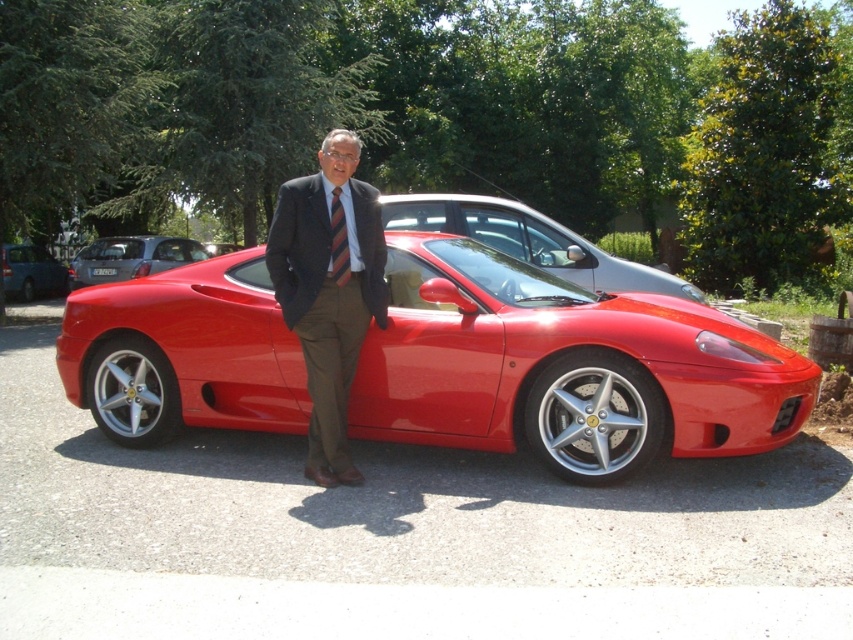
Who is more distant from viewer, (647, 408) or (343, 243)?

Point (647, 408)

Can you confirm if shiny red sports car at center is shorter than striped fabric tie at center?

No, shiny red sports car at center is not shorter than striped fabric tie at center.

At what (x,y) coordinates should I click in order to perform the action: click on shiny red sports car at center. Please return your answer as a coordinate pair (x, y). This screenshot has width=853, height=640. Looking at the image, I should click on (564, 368).

Can you confirm if glossy metallic hatchback at center is wider than matte blue van at left?

No.

Does glossy metallic hatchback at center have a smaller size compared to matte blue van at left?

Indeed, glossy metallic hatchback at center has a smaller size compared to matte blue van at left.

Is point (143, 243) less distant than point (7, 285)?

Yes.

Where is `glossy metallic hatchback at center`? glossy metallic hatchback at center is located at coordinates (131, 257).

Describe the element at coordinates (32, 273) in the screenshot. I see `matte blue van at left` at that location.

You are a GUI agent. You are given a task and a screenshot of the screen. Output one action in this format:
    pyautogui.click(x=<x>, y=<y>)
    Task: Click on the matte blue van at left
    
    Given the screenshot: What is the action you would take?
    pos(32,273)